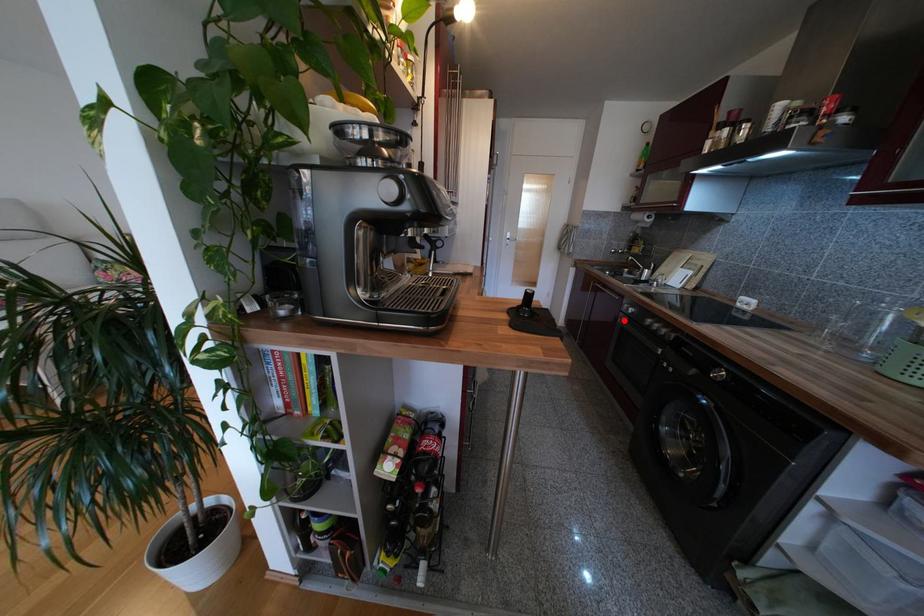
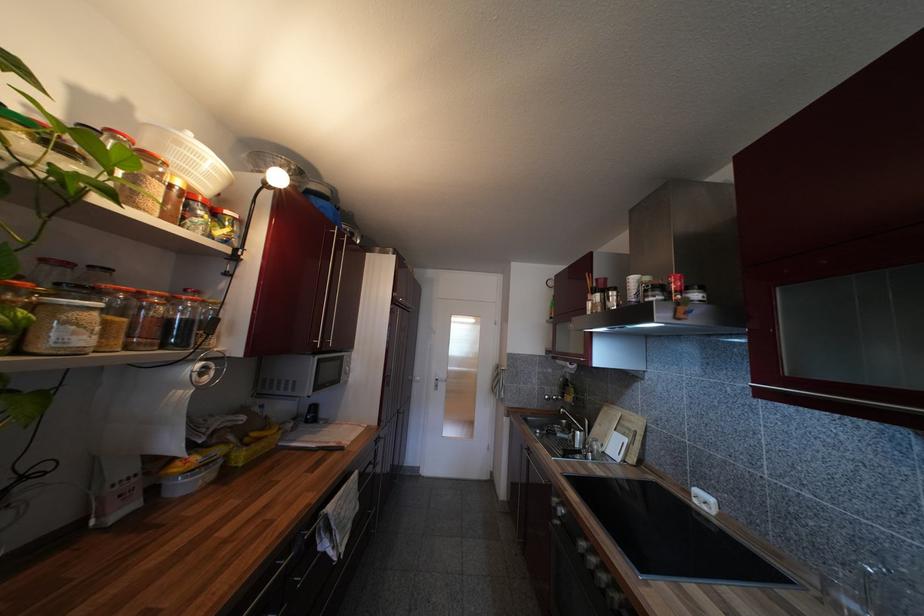
Question: I am providing you with two images of the same scene from different viewpoints. Image1 has a red point marked. In image2, the corresponding 3D location appears at what relative position? Reply with the corresponding letter.

Choices:
 (A) Closer
 (B) Farther

Answer: (B)